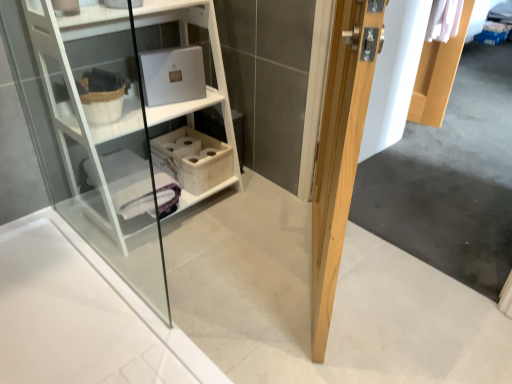
Question: In terms of size, does natural wood door at right appear bigger or smaller than white wood shelf at upper left?

Choices:
 (A) small
 (B) big

Answer: (A)

Question: From their relative heights in the image, would you say natural wood door at right is taller or shorter than white wood shelf at upper left?

Choices:
 (A) tall
 (B) short

Answer: (A)

Question: Estimate the real-world distances between objects in this image. Which object is farther from the white woven basket at center?

Choices:
 (A) natural wood door at right
 (B) white wood shelf at upper left

Answer: (A)

Question: Which of these objects is positioned closest to the white wood shelf at upper left?

Choices:
 (A) natural wood door at right
 (B) white woven basket at center

Answer: (B)